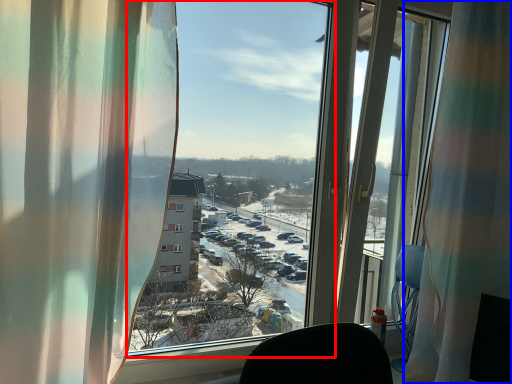
Question: Which object appears farthest to the camera in this image, window screen (highlighted by a red box) or curtain (highlighted by a blue box)?

Choices:
 (A) window screen
 (B) curtain

Answer: (B)